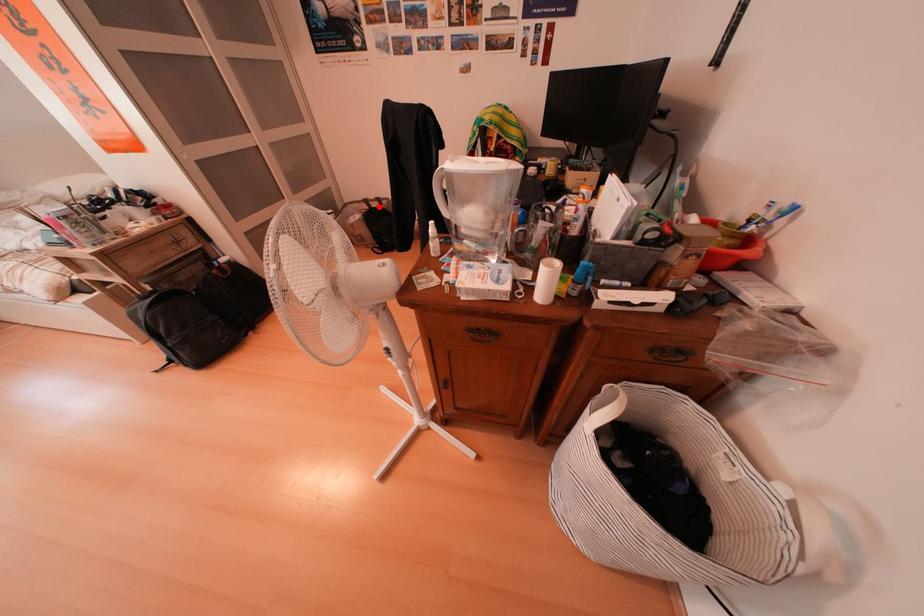
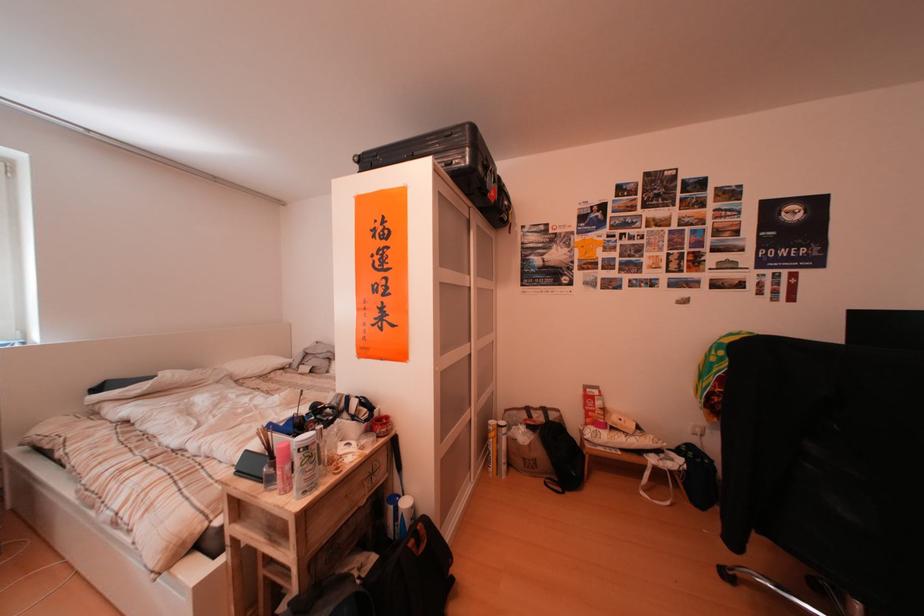
Where in the second image is the point corresponding to the highlighted location from the first image?

(541, 415)